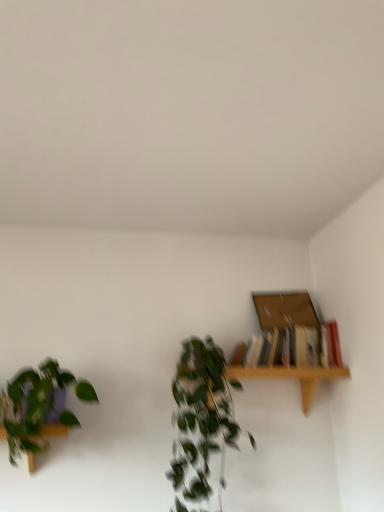
Question: Is green leafy plant at center, which is counted as the second houseplant, starting from the left, surrounding hardcover books at upper right?

Choices:
 (A) yes
 (B) no

Answer: (B)

Question: Can you confirm if green leafy plant at center, marked as the 1th houseplant in a right-to-left arrangement, is wider than hardcover books at upper right?

Choices:
 (A) yes
 (B) no

Answer: (A)

Question: From the image's perspective, does green leafy plant at center, marked as the 1th houseplant in a right-to-left arrangement, appear higher than hardcover books at upper right?

Choices:
 (A) yes
 (B) no

Answer: (B)

Question: Is the depth of green leafy plant at center, marked as the 1th houseplant in a right-to-left arrangement, greater than that of hardcover books at upper right?

Choices:
 (A) no
 (B) yes

Answer: (A)

Question: Can you confirm if green leafy plant at center, marked as the 1th houseplant in a right-to-left arrangement, is smaller than hardcover books at upper right?

Choices:
 (A) no
 (B) yes

Answer: (A)

Question: From a real-world perspective, is green matte plant at left, the first houseplant positioned from the left, positioned above or below hardcover books at upper right?

Choices:
 (A) above
 (B) below

Answer: (B)

Question: Considering the positions of point (6, 429) and point (240, 347), is point (6, 429) closer or farther from the camera than point (240, 347)?

Choices:
 (A) closer
 (B) farther

Answer: (A)

Question: Is green matte plant at left, the first houseplant positioned from the left, bigger or smaller than hardcover books at upper right?

Choices:
 (A) big
 (B) small

Answer: (A)

Question: Visually, is green matte plant at left, the first houseplant positioned from the left, positioned to the left or to the right of hardcover books at upper right?

Choices:
 (A) right
 (B) left

Answer: (B)

Question: From a real-world perspective, is green matte plant at left, the first houseplant positioned from the left, positioned above or below green leafy plant at center, marked as the 1th houseplant in a right-to-left arrangement?

Choices:
 (A) above
 (B) below

Answer: (A)

Question: Is green matte plant at left, the second houseplant from the right, inside the boundaries of green leafy plant at center, which is counted as the second houseplant, starting from the left, or outside?

Choices:
 (A) inside
 (B) outside

Answer: (B)

Question: From the image's perspective, is green matte plant at left, the first houseplant positioned from the left, above or below green leafy plant at center, marked as the 1th houseplant in a right-to-left arrangement?

Choices:
 (A) above
 (B) below

Answer: (A)

Question: Does point (69, 384) appear closer or farther from the camera than point (190, 352)?

Choices:
 (A) farther
 (B) closer

Answer: (B)

Question: Is green leafy plant at center, marked as the 1th houseplant in a right-to-left arrangement, taller or shorter than brown cardboard box at upper right?

Choices:
 (A) tall
 (B) short

Answer: (A)

Question: From the image's perspective, is green leafy plant at center, marked as the 1th houseplant in a right-to-left arrangement, above or below brown cardboard box at upper right?

Choices:
 (A) above
 (B) below

Answer: (B)